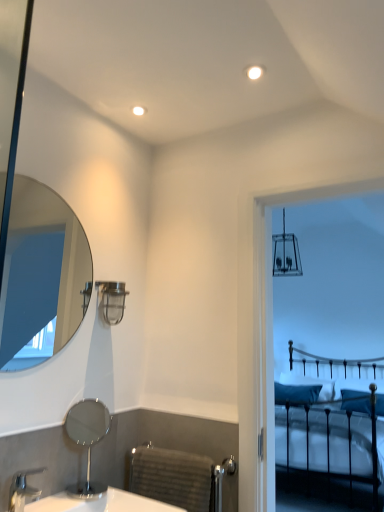
Question: Which direction should I rotate to look at metallic industrial light fixture at upper center?

Choices:
 (A) left
 (B) right

Answer: (A)

Question: Is white glossy sink at lower left located within silver metallic faucet at lower left?

Choices:
 (A) yes
 (B) no

Answer: (B)

Question: From the image's perspective, is silver metallic faucet at lower left above white glossy sink at lower left?

Choices:
 (A) yes
 (B) no

Answer: (A)

Question: Does silver metallic faucet at lower left touch white glossy sink at lower left?

Choices:
 (A) yes
 (B) no

Answer: (B)

Question: Can you confirm if silver metallic faucet at lower left is bigger than white glossy sink at lower left?

Choices:
 (A) no
 (B) yes

Answer: (A)

Question: Is silver metallic faucet at lower left positioned before white glossy sink at lower left?

Choices:
 (A) yes
 (B) no

Answer: (B)

Question: Considering the relative sizes of silver metallic faucet at lower left and white glossy sink at lower left in the image provided, is silver metallic faucet at lower left wider than white glossy sink at lower left?

Choices:
 (A) yes
 (B) no

Answer: (B)

Question: Is clear glass mirror at upper left, arranged as the first mirror when viewed from the top, smaller than silver metallic faucet at lower left?

Choices:
 (A) yes
 (B) no

Answer: (B)

Question: Does clear glass mirror at upper left, the 2th mirror when ordered from bottom to top, have a larger size compared to silver metallic faucet at lower left?

Choices:
 (A) no
 (B) yes

Answer: (B)

Question: Can you confirm if clear glass mirror at upper left, the 2th mirror when ordered from bottom to top, is positioned to the left of silver metallic faucet at lower left?

Choices:
 (A) no
 (B) yes

Answer: (B)

Question: Considering the relative sizes of clear glass mirror at upper left, arranged as the first mirror when viewed from the top, and silver metallic faucet at lower left in the image provided, is clear glass mirror at upper left, arranged as the first mirror when viewed from the top, thinner than silver metallic faucet at lower left?

Choices:
 (A) yes
 (B) no

Answer: (A)

Question: Is silver metallic faucet at lower left at the back of clear glass mirror at upper left, arranged as the first mirror when viewed from the top?

Choices:
 (A) no
 (B) yes

Answer: (A)

Question: Is clear glass mirror at upper left, the 2th mirror when ordered from bottom to top, with silver metallic faucet at lower left?

Choices:
 (A) yes
 (B) no

Answer: (B)

Question: From a real-world perspective, is clear glass mirror at upper left, the 2th mirror when ordered from bottom to top, under metallic industrial light fixture at upper center?

Choices:
 (A) no
 (B) yes

Answer: (A)